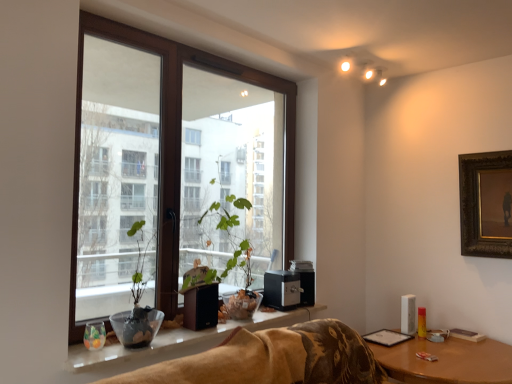
Image resolution: width=512 pixels, height=384 pixels. Find the location of `gold-framed painting at upper right`. gold-framed painting at upper right is located at coordinates (486, 204).

Where is `white glossy window sill at lower center`? white glossy window sill at lower center is located at coordinates (173, 344).

How different are the orientations of green matte plant at center and brown wooden table at lower right in degrees?

The facing directions of green matte plant at center and brown wooden table at lower right are 0.0971 degrees apart.

Which is less distant, (148, 306) or (428, 351)?

The point (148, 306) is more forward.

From the image's perspective, who appears lower, green matte plant at center or brown wooden table at lower right?

brown wooden table at lower right, from the image's perspective.

Is green matte plant at center turned away from brown wooden table at lower right?

No, green matte plant at center is not facing the opposite direction of brown wooden table at lower right.

Is brown wooden table at lower right oriented towards white glossy window sill at lower center?

No, brown wooden table at lower right does not turn towards white glossy window sill at lower center.

From a real-world perspective, is brown wooden table at lower right positioned over white glossy window sill at lower center based on gravity?

Incorrect, from a real-world perspective, brown wooden table at lower right is lower than white glossy window sill at lower center.

From the image's perspective, is brown wooden table at lower right located beneath white glossy window sill at lower center?

Yes, from the image's perspective, brown wooden table at lower right is below white glossy window sill at lower center.

Is brown wooden table at lower right positioned beyond the bounds of white glossy window sill at lower center?

That's correct, brown wooden table at lower right is outside of white glossy window sill at lower center.

Which is in front, point (469, 248) or point (134, 46)?

The point (134, 46) is in front.

Is gold-framed painting at upper right positioned with its back to brown wooden window at center?

That's not correct — gold-framed painting at upper right is not looking away from brown wooden window at center.

Is gold-framed painting at upper right shorter than brown wooden window at center?

Yes, gold-framed painting at upper right is shorter than brown wooden window at center.

From a real-world perspective, is gold-framed painting at upper right below brown wooden window at center?

Yes, from a real-world perspective, gold-framed painting at upper right is beneath brown wooden window at center.

Is white glossy window sill at lower center not inside gold-framed painting at upper right?

Yes, white glossy window sill at lower center is not within gold-framed painting at upper right.

Between white glossy window sill at lower center and gold-framed painting at upper right, which one has less height?

With less height is white glossy window sill at lower center.

Is point (269, 322) farther from camera compared to point (483, 208)?

No, it is not.

From a real-world perspective, is white glossy window sill at lower center physically below gold-framed painting at upper right?

Yes, from a real-world perspective, white glossy window sill at lower center is under gold-framed painting at upper right.

Is green matte plant at center at the back of brown wooden window at center?

Yes, green matte plant at center is at the back of brown wooden window at center.

From a real-world perspective, does brown wooden window at center sit lower than green matte plant at center?

No, from a real-world perspective, brown wooden window at center is not below green matte plant at center.

Would you say brown wooden window at center is inside or outside green matte plant at center?

brown wooden window at center is spatially situated outside green matte plant at center.

In the image, there is a brown wooden window at center. Where is `window sill below it (from the image's perspective)`? This screenshot has height=384, width=512. window sill below it (from the image's perspective) is located at coordinates (173, 344).

Can you see white glossy window sill at lower center touching brown wooden window at center?

No.

In the scene shown: Is white glossy window sill at lower center to the left or to the right of brown wooden window at center in the image?

white glossy window sill at lower center is to the right of brown wooden window at center.

Considering the positions of point (309, 317) and point (94, 25), is point (309, 317) closer or farther from the camera than point (94, 25)?

Point (309, 317) is positioned farther from the camera compared to point (94, 25).

From a real-world perspective, who is located higher, gold-framed painting at upper right or brown wooden table at lower right?

gold-framed painting at upper right, from a real-world perspective.

Is gold-framed painting at upper right looking in the opposite direction of brown wooden table at lower right?

No, brown wooden table at lower right is not at the back of gold-framed painting at upper right.

From the image's perspective, who appears lower, gold-framed painting at upper right or brown wooden table at lower right?

brown wooden table at lower right is shown below in the image.

This screenshot has height=384, width=512. In order to click on houseplant to the left of brown wooden table at lower right in this screenshot , I will do `click(137, 301)`.

Where is `window sill above the brown wooden table at lower right (from a real-world perspective)`? window sill above the brown wooden table at lower right (from a real-world perspective) is located at coordinates (173, 344).

When comparing their distances from brown wooden table at lower right, does white glossy window sill at lower center or green matte plant at center seem further?

The object further to brown wooden table at lower right is green matte plant at center.

Consider the image. When comparing their distances from green matte plant at center, does brown wooden table at lower right or brown wooden window at center seem closer?

brown wooden window at center lies closer to green matte plant at center than the other object.

Which object lies nearer to the anchor point gold-framed painting at upper right, brown wooden window at center or white glossy window sill at lower center?

Based on the image, brown wooden window at center appears to be nearer to gold-framed painting at upper right.

Consider the image. From the image, which object appears to be farther from green matte plant at center, white glossy window sill at lower center or brown wooden window at center?

Among the two, brown wooden window at center is located further to green matte plant at center.

Looking at the image, which one is located further to green matte plant at center, white glossy window sill at lower center or gold-framed painting at upper right?

Among the two, gold-framed painting at upper right is located further to green matte plant at center.

Estimate the real-world distances between objects in this image. Which object is closer to gold-framed painting at upper right, brown wooden table at lower right or brown wooden window at center?

Based on the image, brown wooden table at lower right appears to be nearer to gold-framed painting at upper right.

Considering their positions, is gold-framed painting at upper right positioned closer to brown wooden window at center than green matte plant at center?

The object closer to brown wooden window at center is green matte plant at center.

When comparing their distances from white glossy window sill at lower center, does brown wooden window at center or gold-framed painting at upper right seem closer?

brown wooden window at center.

Locate an element on the screen. The width and height of the screenshot is (512, 384). table between green matte plant at center and gold-framed painting at upper right from left to right is located at coordinates (447, 361).

Where is `houseplant between brown wooden window at center and white glossy window sill at lower center vertically`? This screenshot has width=512, height=384. houseplant between brown wooden window at center and white glossy window sill at lower center vertically is located at coordinates (137, 301).

Find the location of a particular element. window sill between brown wooden window at center and gold-framed painting at upper right in the horizontal direction is located at coordinates (173, 344).

Where is `window between green matte plant at center and brown wooden table at lower right from left to right`? window between green matte plant at center and brown wooden table at lower right from left to right is located at coordinates (177, 144).